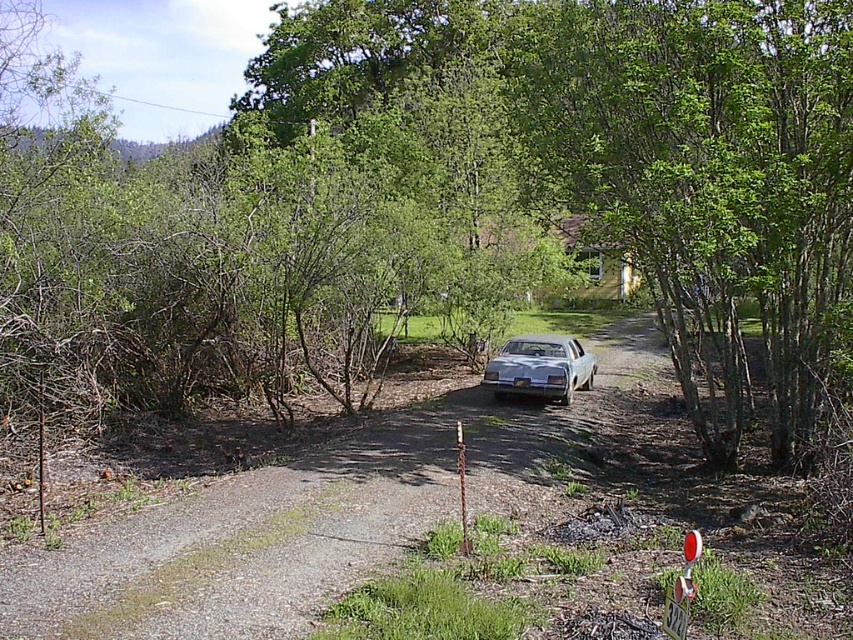
Question: Which object appears farthest from the camera in this image?

Choices:
 (A) green leafy tree at center
 (B) silver metallic car at center

Answer: (B)

Question: Is green leafy tree at center to the left of silver metallic car at center from the viewer's perspective?

Choices:
 (A) no
 (B) yes

Answer: (B)

Question: Does green leafy tree at center appear under silver metallic car at center?

Choices:
 (A) no
 (B) yes

Answer: (A)

Question: Among these objects, which one is farthest from the camera?

Choices:
 (A) green leafy tree at center
 (B) silver metallic car at center

Answer: (B)

Question: Does green leafy tree at center appear under silver metallic car at center?

Choices:
 (A) yes
 (B) no

Answer: (B)